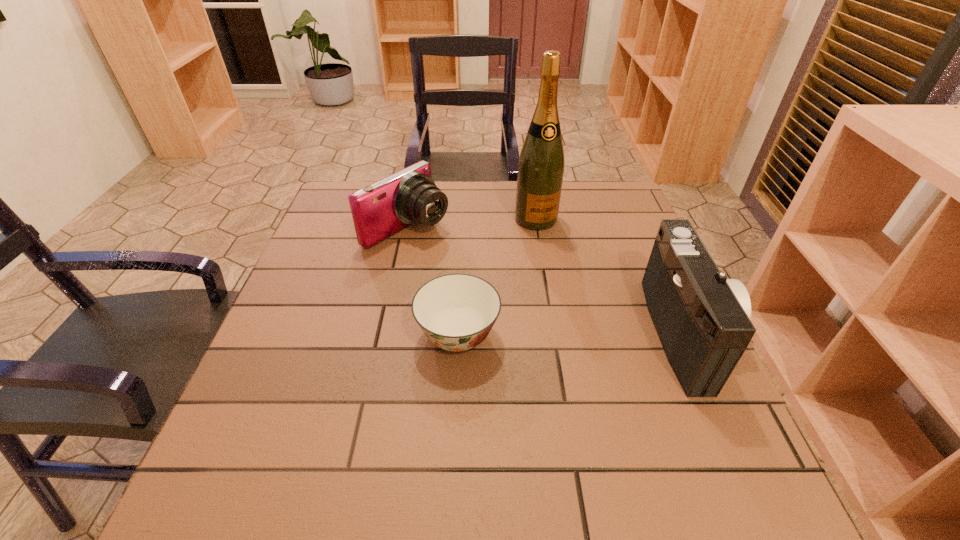
Identify the location of soup bowl. This screenshot has width=960, height=540. (456, 312).

Image resolution: width=960 pixels, height=540 pixels. I want to click on the second tallest object, so click(x=702, y=319).

The width and height of the screenshot is (960, 540). I want to click on the rightmost object, so click(702, 319).

Find the location of a particular element. This screenshot has width=960, height=540. the tallest object is located at coordinates pos(541,164).

You are a GUI agent. You are given a task and a screenshot of the screen. Output one action in this format:
    pyautogui.click(x=<x>, y=<y>)
    Task: Click on the third object from left to right
    
    Given the screenshot: What is the action you would take?
    (x=541, y=164)

Where is `the second shortest object`? The image size is (960, 540). the second shortest object is located at coordinates (379, 210).

You are a GUI agent. You are given a task and a screenshot of the screen. Output one action in this format:
    pyautogui.click(x=<x>, y=<y>)
    Task: Click on the vacant area situated 0.050m on the left of the soup bowl
    This screenshot has width=960, height=540.
    Given the screenshot: What is the action you would take?
    pyautogui.click(x=393, y=335)

Identify the location of vacant space located 0.160m on the front-facing side of the tallest object. (563, 269).

Locate an element on the screen. This screenshot has height=540, width=960. free space located 0.080m on the front-facing side of the tallest object is located at coordinates pos(552,249).

At what (x,y) coordinates should I click in order to perform the action: click on vacant position located on the front-facing side of the tallest object. Please return your answer as a coordinate pair (x, y). Looking at the image, I should click on (580, 302).